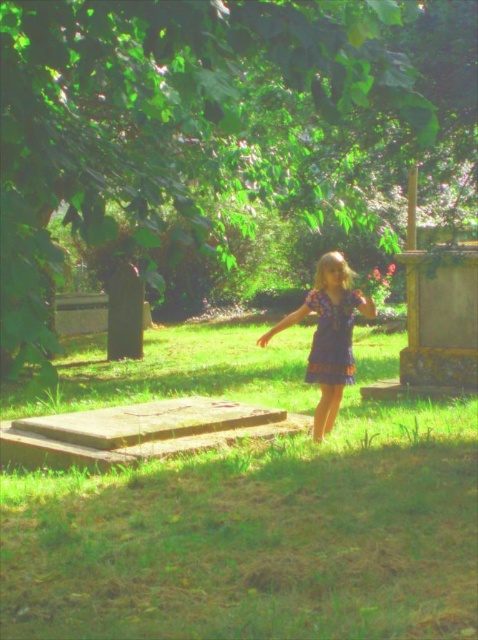
Is green grass at center smaller than blue lace dress at center?

No, green grass at center is not smaller than blue lace dress at center.

Who is higher up, green grass at center or blue lace dress at center?

blue lace dress at center is above.

Where is `green grass at center`? The height and width of the screenshot is (640, 478). green grass at center is located at coordinates (260, 532).

Does green grass at center have a greater height compared to purple cotton dress at center?

Correct, green grass at center is much taller as purple cotton dress at center.

Is point (305, 580) positioned after point (293, 316)?

That is False.

Who is more forward, (467, 509) or (312, 362)?

Positioned in front is point (467, 509).

At what (x,y) coordinates should I click in order to perform the action: click on green grass at center. Please return your answer as a coordinate pair (x, y). The width and height of the screenshot is (478, 640). Looking at the image, I should click on (260, 532).

Between point (319, 412) and point (314, 355), which one is positioned in front?

Point (314, 355) is more forward.

Is purple cotton dress at center shorter than blue lace dress at center?

Indeed, purple cotton dress at center has a lesser height compared to blue lace dress at center.

I want to click on purple cotton dress at center, so click(x=328, y=333).

Locate an element on the screen. purple cotton dress at center is located at coordinates (328, 333).